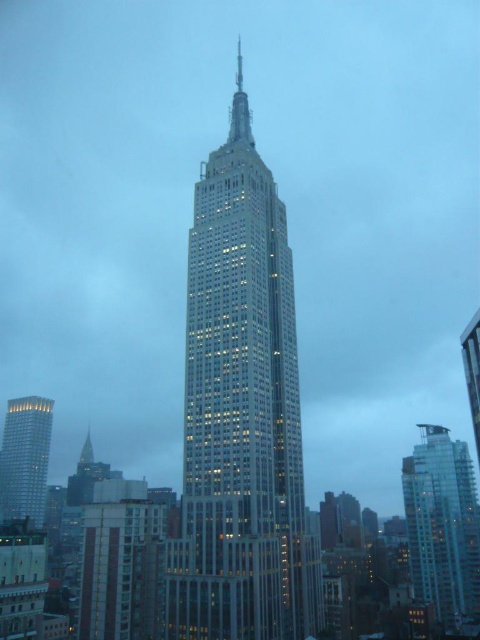
You are standing on the observation deck of the Empire State Building. You look down and see the glassy steel skyscraper at center and the silver glass tower at lower left. Which one is higher from your viewpoint?

The glassy steel skyscraper at center is above the silver glass tower at lower left from your viewpoint on the observation deck.

You are an architect evaluating the skyline of New York City as shown in the image. You need to determine which of the two structures, the glassy silver skyscraper at right or the silver glass tower at lower left, would require more materials for constructing its exterior cladding. Based on their heights, which one would likely need more materials?

The glassy silver skyscraper at right is much taller than the silver glass tower at lower left, so it would likely require more materials for constructing its exterior cladding due to its greater height.

You are a drone operator planning to fly a drone from the top of the glassy steel skyscraper at center to the top of the glassy silver skyscraper at right. Considering the height difference between them, will the drone need to ascend or descend during the flight?

The glassy steel skyscraper at center is taller than the glassy silver skyscraper at right. Therefore, the drone will need to descend during the flight.